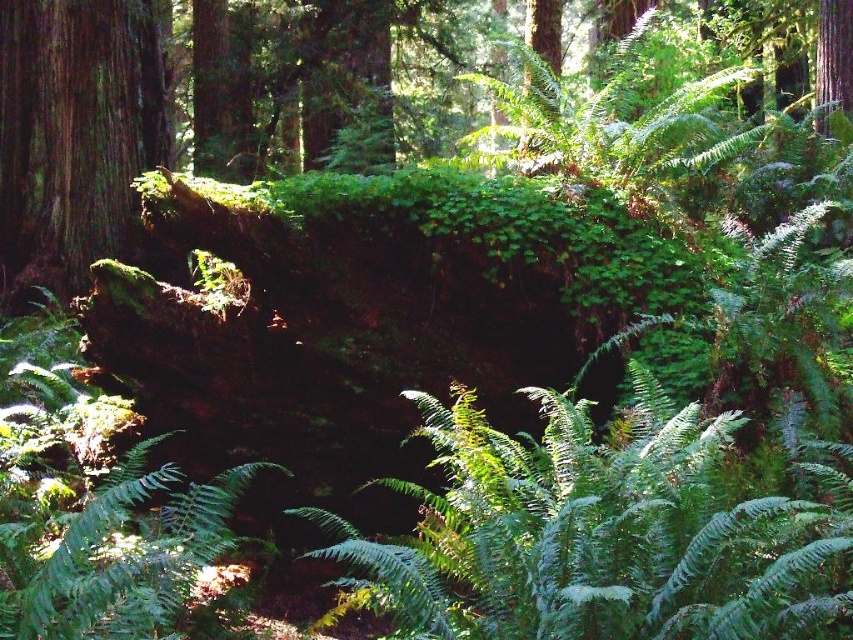
You are a hiker who wants to cross the forest path. You see the green mossy log at left and the green leafy fern at upper center. How far apart are these two landmarks?

The green mossy log at left and the green leafy fern at upper center are 6.21 meters apart.

You are navigating through the forest and want to reach a specific location. You see two points marked in the scene. Which point is closer to you, point (415, 392) or point (55, 8)?

Point (415, 392) is in front of point (55, 8), so it is closer to you.

You are a hiker who wants to cross the forest floor. You see the green mossy log at left and the green leafy fern at upper center. Which object is positioned more to the left side of the image?

The green mossy log at left is positioned to the left of the green leafy fern at upper center, so it is more to the left side of the image.